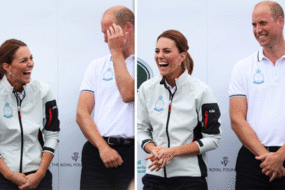
I want to click on metal wall, so click(x=223, y=59), click(x=65, y=45).